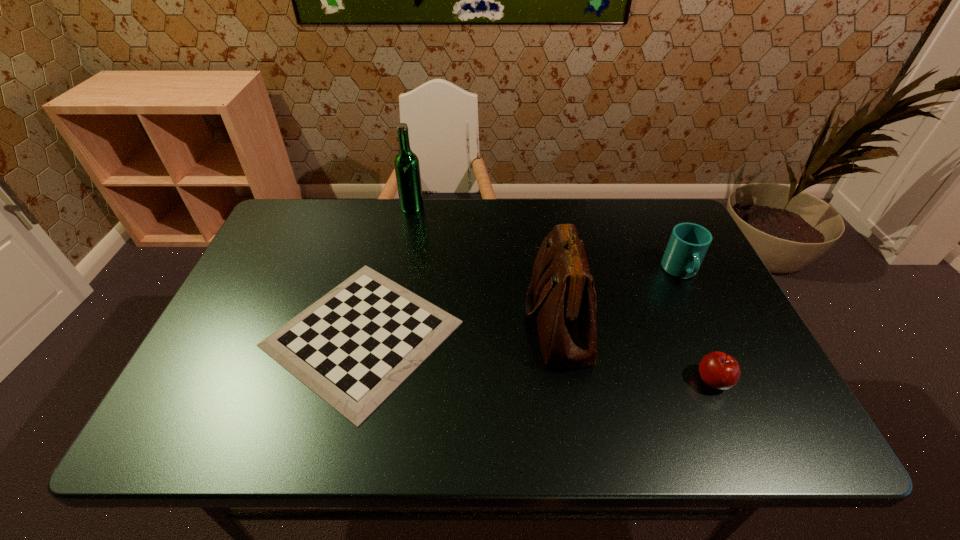
Find the location of a particular element. This screenshot has width=960, height=540. the farthest object is located at coordinates (406, 163).

Find the location of `the third object from left to right`. the third object from left to right is located at coordinates (561, 295).

You are a GUI agent. You are given a task and a screenshot of the screen. Output one action in this format:
    pyautogui.click(x=<x>, y=<y>)
    Task: Click on the third shortest object
    The width and height of the screenshot is (960, 540).
    Given the screenshot: What is the action you would take?
    [688, 244]

This screenshot has width=960, height=540. In order to click on the second shortest object in this screenshot , I will do `click(720, 371)`.

The image size is (960, 540). What are the coordinates of `chessboard` in the screenshot? It's located at (353, 347).

The width and height of the screenshot is (960, 540). Find the location of `vacant area situated on the left of the farthest object`. vacant area situated on the left of the farthest object is located at coordinates (286, 207).

Identify the location of vacant space located 0.150m on the front of the third object from left to right. This screenshot has width=960, height=540. (581, 440).

This screenshot has width=960, height=540. In order to click on vacant area situated 0.180m on the handle side of the cup in this screenshot , I will do `click(714, 343)`.

This screenshot has width=960, height=540. Find the location of `free space located on the back of the apple`. free space located on the back of the apple is located at coordinates click(x=687, y=321).

Identify the location of free space located 0.140m on the right of the chessboard. Image resolution: width=960 pixels, height=540 pixels. (520, 334).